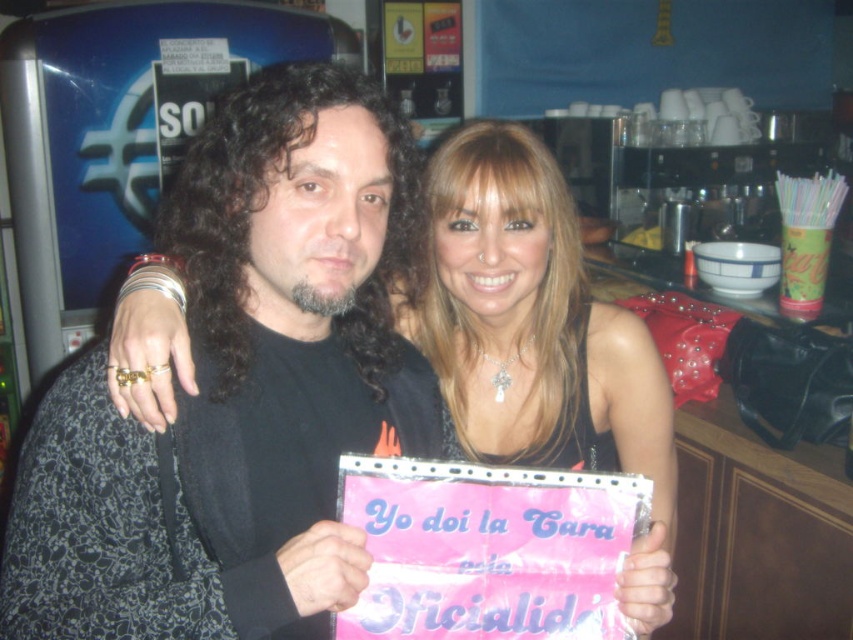
You are standing in a cafe and see a point marked at coordinates (263, 192). If you want to place a 12 inch wide coffee mug on the table, will there be enough space between the point and the edge of the table?

The point at (263, 192) is 32.35 inches away from the viewer. Since the coffee mug is only 12 inches wide, there should be sufficient space between the point and the edge of the table to place it comfortably.

You are a fashion designer observing two black garments in the image. The first is a black matte shirt at center, and the second is a shiny black dress at center. Which garment has a shorter length?

The black matte shirt at center is shorter than the shiny black dress at center.

You are a tailor measuring two pieces of fabric for alterations. The first is the black matte shirt at center and the second is the shiny black dress at center. The tailor requires a minimum of 30 centimeters between the two fabrics to work comfortably. Based on the image, can the tailor proceed with the current setup?

The distance between the black matte shirt at center and the shiny black dress at center is 27.99 centimeters, which is less than the required 30 centimeters. The tailor should rearrange the fabrics to ensure sufficient space.